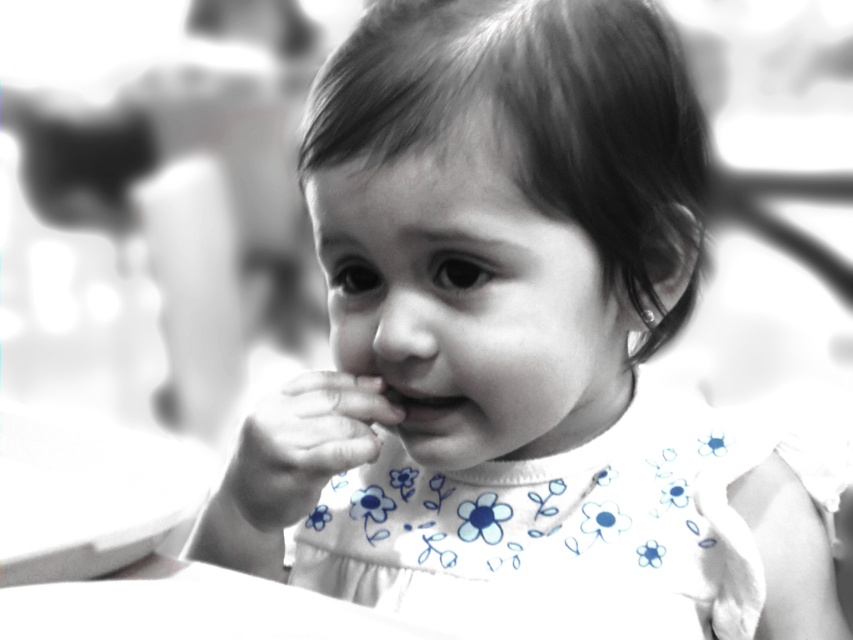
You are a photographer adjusting the focus on your camera. The subject is the smooth skin hand at center. If your camera requires the focus point to be exactly 20 inches away, is the current distance sufficient? Please explain.

The smooth skin hand at center is 18.74 inches away from the camera, which is closer than the required 20 inches. Therefore, the current distance is insufficient, and you need to move the camera back or adjust the focus to accommodate the shorter distance.

Based on the coordinates provided in the image, where is the smooth skin hand at center located?

The smooth skin hand at center is located at the 2D coordinates point (300, 445).

In the photograph, you see a child with a smooth skin hand at center and a smooth skin mouth at center. Which object is wider?

The smooth skin hand at center is wider than the smooth skin mouth at center.